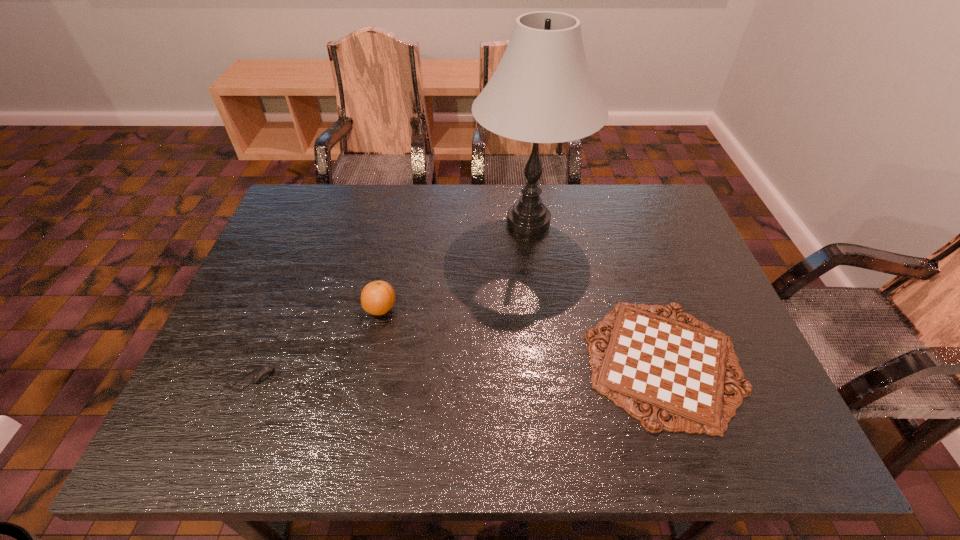
You are a GUI agent. You are given a task and a screenshot of the screen. Output one action in this format:
    pyautogui.click(x=<x>, y=<y>)
    Task: Click on the tallest object
    
    Given the screenshot: What is the action you would take?
    pyautogui.click(x=542, y=91)

I want to click on lamp, so click(542, 91).

You are a GUI agent. You are given a task and a screenshot of the screen. Output one action in this format:
    pyautogui.click(x=<x>, y=<y>)
    Task: Click on the second tallest object
    The width and height of the screenshot is (960, 540).
    Given the screenshot: What is the action you would take?
    pyautogui.click(x=378, y=297)

I want to click on orange, so click(x=378, y=297).

Identify the location of the leftmost object. (263, 373).

Identify the location of chessboard. (671, 368).

This screenshot has height=540, width=960. I want to click on free space located on the left of the farthest object, so click(400, 221).

Where is `vacant space located on the right of the orange`? vacant space located on the right of the orange is located at coordinates [x=454, y=309].

Locate an element on the screen. blank area located 0.060m on the back of the mouse is located at coordinates (266, 345).

Where is `free location located on the back of the chessboard`? free location located on the back of the chessboard is located at coordinates (616, 222).